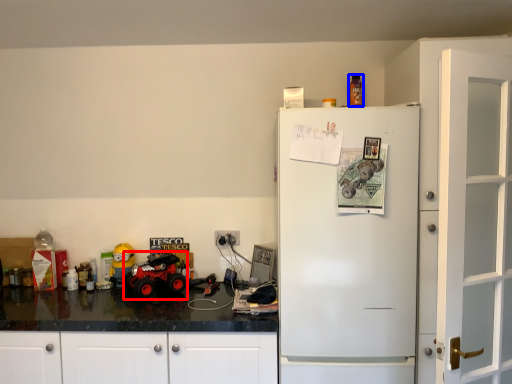
Question: Which point is further to the camera, monster truck (highlighted by a red box) or toy (highlighted by a blue box)?

Choices:
 (A) monster truck
 (B) toy

Answer: (B)